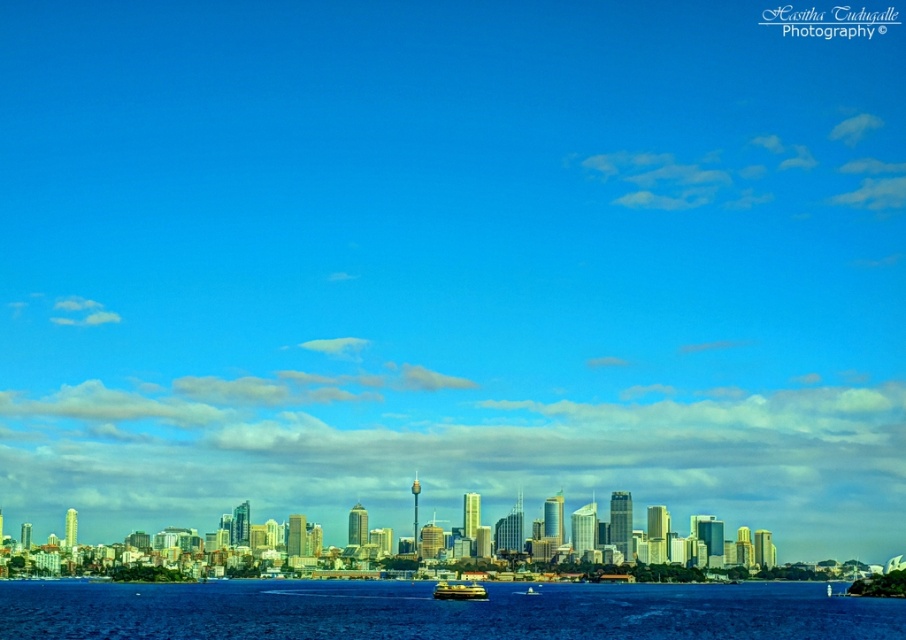
Does blue liquid water at lower center have a larger size compared to yellow matte boat at center?

Yes.

Describe the element at coordinates (439, 611) in the screenshot. The image size is (906, 640). I see `blue liquid water at lower center` at that location.

Locate an element on the screen. blue liquid water at lower center is located at coordinates (439, 611).